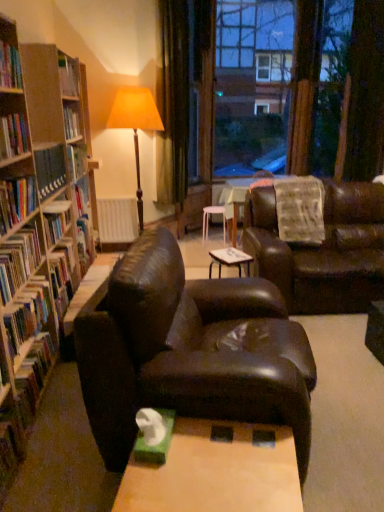
This screenshot has height=512, width=384. I want to click on empty space that is to the right of green matte tissue box at lower center, so click(x=193, y=445).